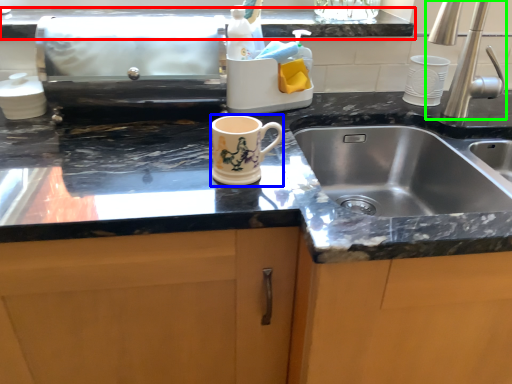
Question: Which object is positioned closest to countertop (highlighted by a red box)? Select from mug (highlighted by a blue box) and tap (highlighted by a green box).

Choices:
 (A) mug
 (B) tap

Answer: (B)